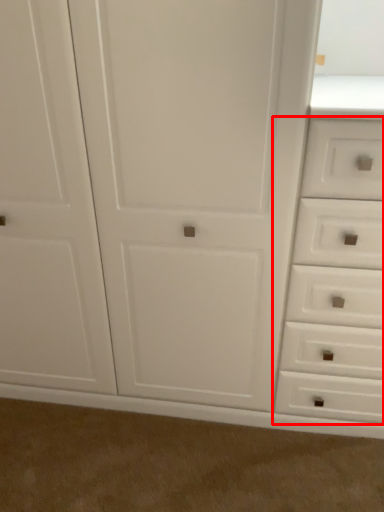
Question: Where is drawer (annotated by the red box) located in relation to plain in the image?

Choices:
 (A) right
 (B) left

Answer: (A)